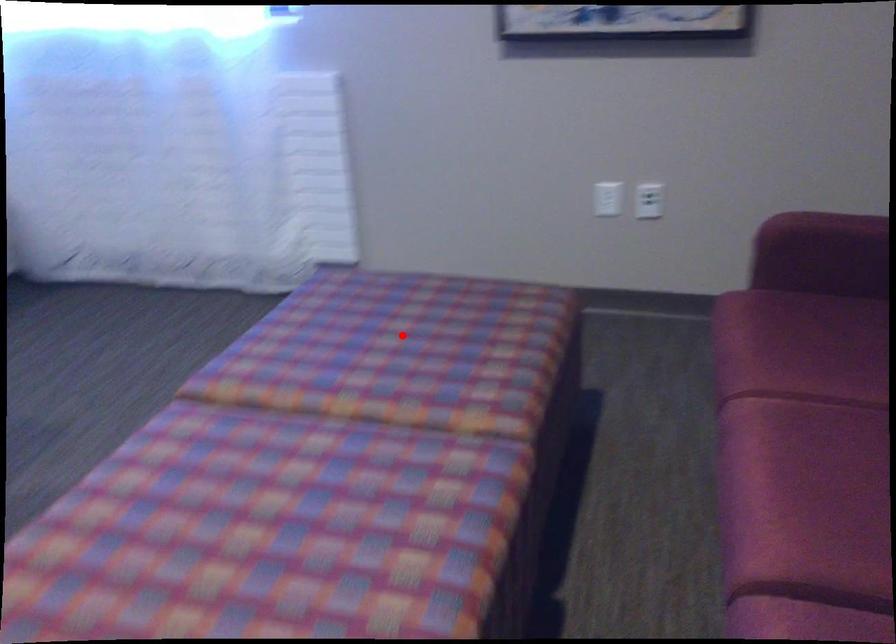
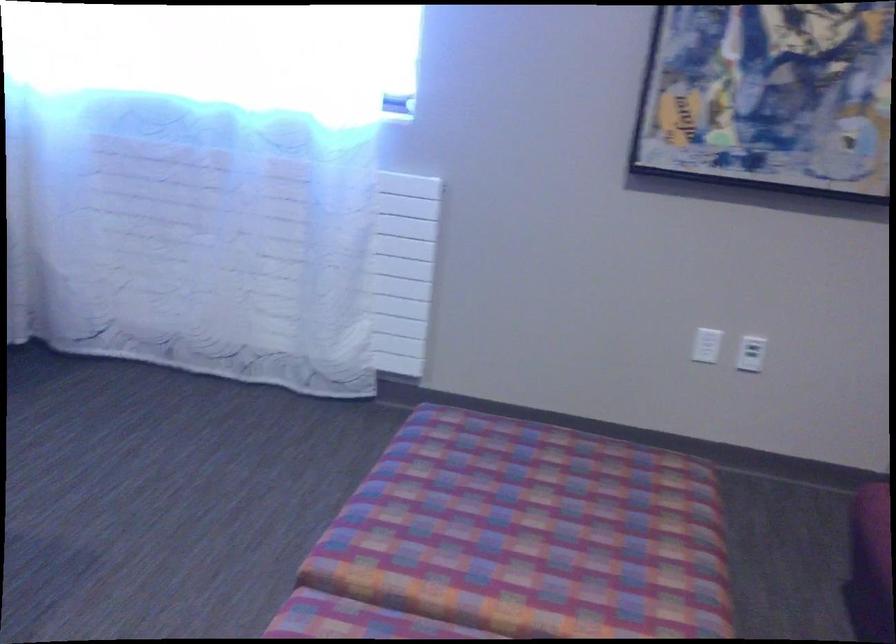
Question: I am providing you with two images of the same scene from different viewpoints. In image1, a red point is highlighted. Considering the same 3D point in image2, which of the following is correct?

Choices:
 (A) It is closer
 (B) It is farther

Answer: (A)